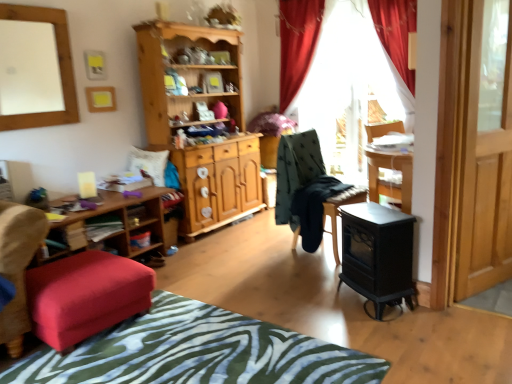
Locate an element on the screen. free space to the left of dark green fabric chair at center is located at coordinates (264, 250).